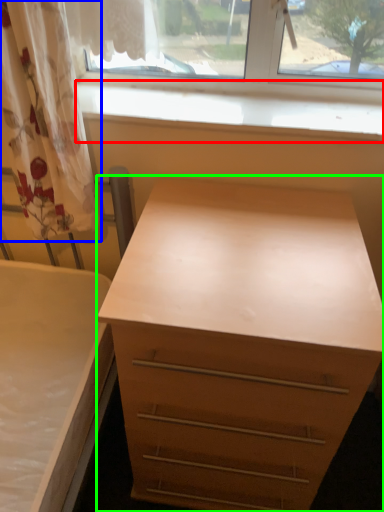
Question: Based on their relative distances, which object is farther from window sill (highlighted by a red box)? Choose from curtain (highlighted by a blue box) and chest of drawers (highlighted by a green box).

Choices:
 (A) curtain
 (B) chest of drawers

Answer: (B)